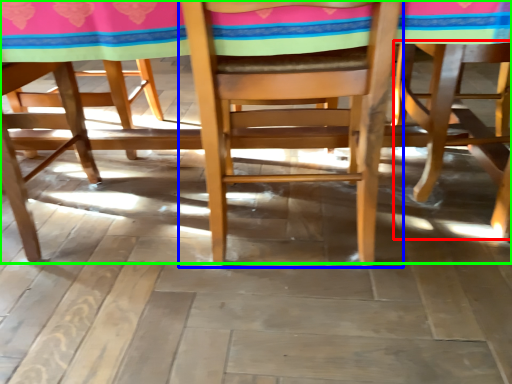
Question: Considering the real-world distances, which object is farthest from chair (highlighted by a red box)? chair (highlighted by a blue box) or table (highlighted by a green box)?

Choices:
 (A) chair
 (B) table

Answer: (A)